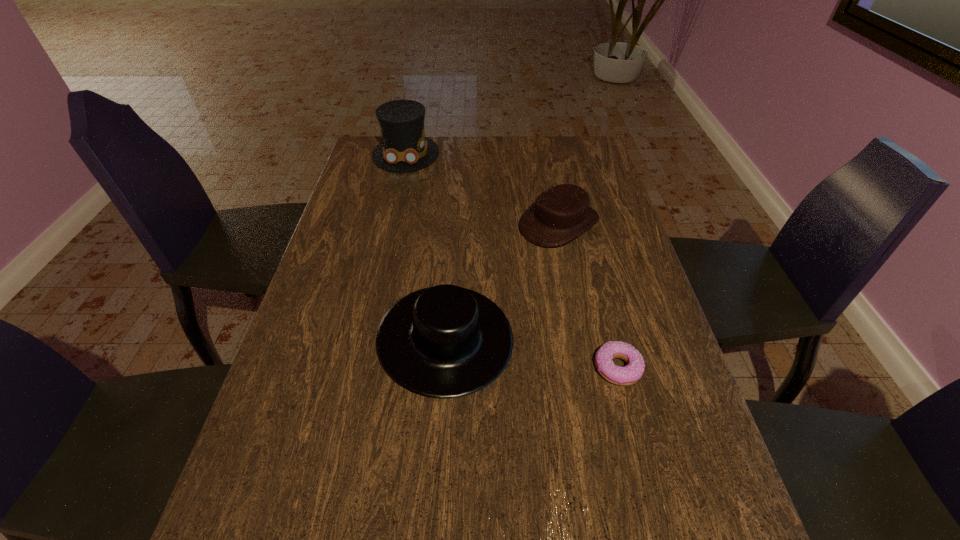
Find the location of `the farthest object`. the farthest object is located at coordinates (404, 148).

Find the location of a particular element. The image size is (960, 540). the tallest object is located at coordinates (404, 148).

Locate an element on the screen. the third shortest object is located at coordinates (445, 341).

I want to click on the second shortest hat, so (445, 341).

The image size is (960, 540). Find the location of `the second nearest hat`. the second nearest hat is located at coordinates (560, 214).

Image resolution: width=960 pixels, height=540 pixels. What are the coordinates of `the second farthest object` in the screenshot? It's located at click(560, 214).

This screenshot has height=540, width=960. What are the coordinates of `the shortest object` in the screenshot? It's located at (632, 372).

Image resolution: width=960 pixels, height=540 pixels. I want to click on free location located with goggles on the front of the tallest object, so click(399, 183).

Locate an element on the screen. The width and height of the screenshot is (960, 540). free location located on the front of the second shortest hat is located at coordinates (438, 465).

Where is `vacant space located 0.220m on the left of the shortest hat`? This screenshot has height=540, width=960. vacant space located 0.220m on the left of the shortest hat is located at coordinates (444, 224).